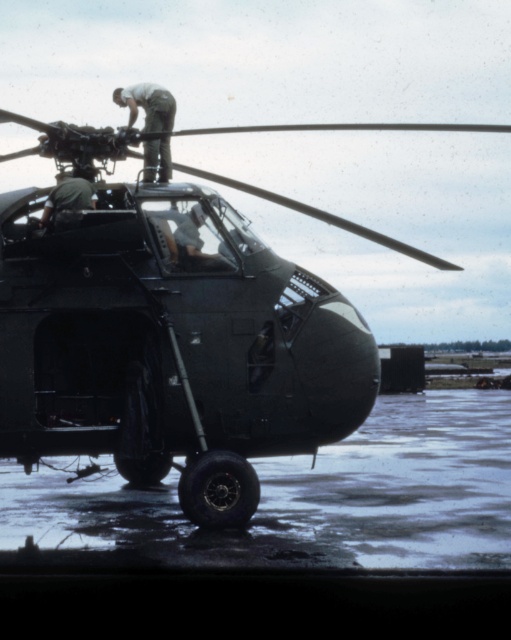
You are a drone operator observing the scene. You need to locate the green fabric man at upper center. According to the coordinates provided, where would you direct the drone to find him?

The green fabric man at upper center is located at coordinates point [148,106].

You are a technician standing at point (x=53, y=188) and need to reach point (x=167, y=99) to inspect the helicopter engine. Is the path between these two points clear of any obstacles?

Point (x=167, y=99) is behind point (x=53, y=188), so there might be an obstacle between them. You should check for any obstructions before proceeding.